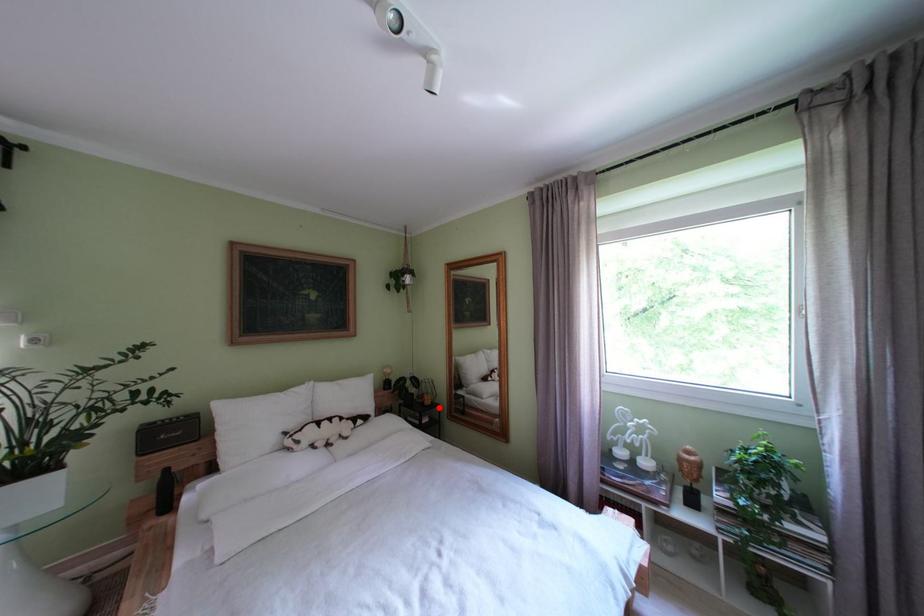
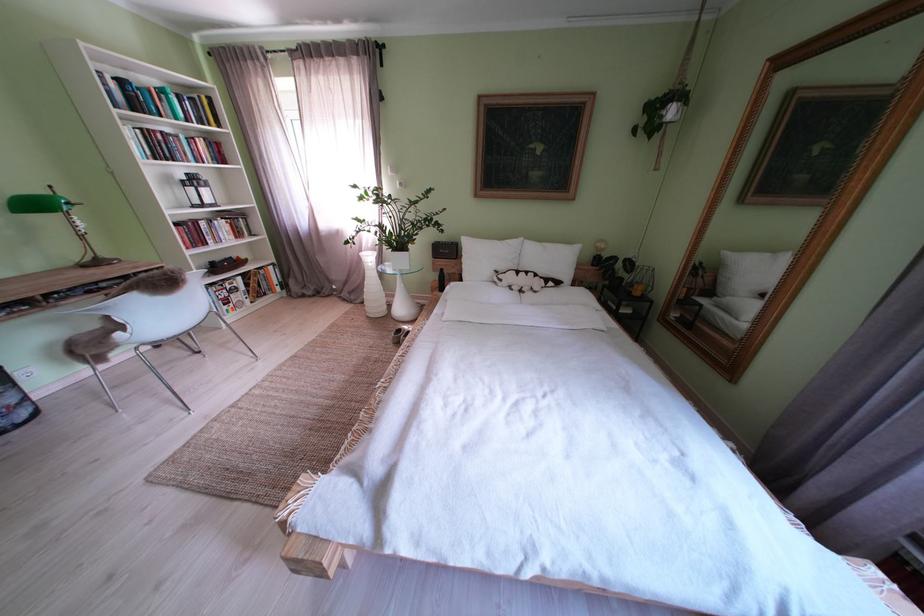
In the second image, find the point that corresponds to the highlighted location in the first image.

(648, 299)